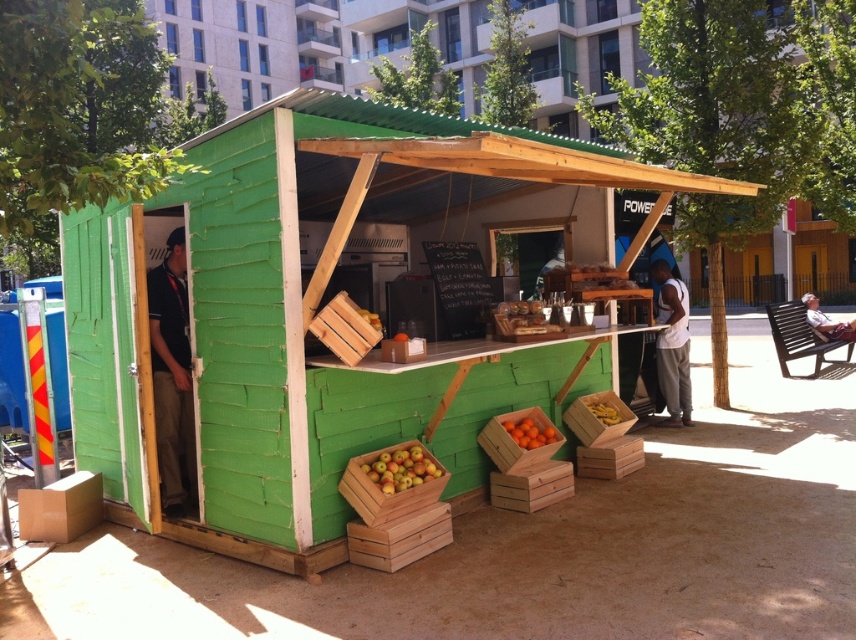
Question: Among these objects, which one is nearest to the camera?

Choices:
 (A) light brown wooden bench at lower right
 (B) white cotton tank top at right
 (C) orange matte wooden crate at lower center

Answer: (C)

Question: Does orange matte wooden crate at lower center lie behind wooden crate at center?

Choices:
 (A) yes
 (B) no

Answer: (A)

Question: Considering the real-world distances, which object is farthest from the red matte apples at lower left?

Choices:
 (A) black shirt at left
 (B) light brown wooden bench at lower right

Answer: (B)

Question: Is white cotton tank top at right thinner than orange matte wooden crate at lower center?

Choices:
 (A) no
 (B) yes

Answer: (B)

Question: Which object is positioned closest to the orange matte wooden crate at lower center?

Choices:
 (A) black shirt at left
 (B) red matte apples at lower left
 (C) light brown wooden bench at lower right

Answer: (B)

Question: Is the position of red matte apples at lower left less distant than that of wooden crate at center?

Choices:
 (A) no
 (B) yes

Answer: (A)